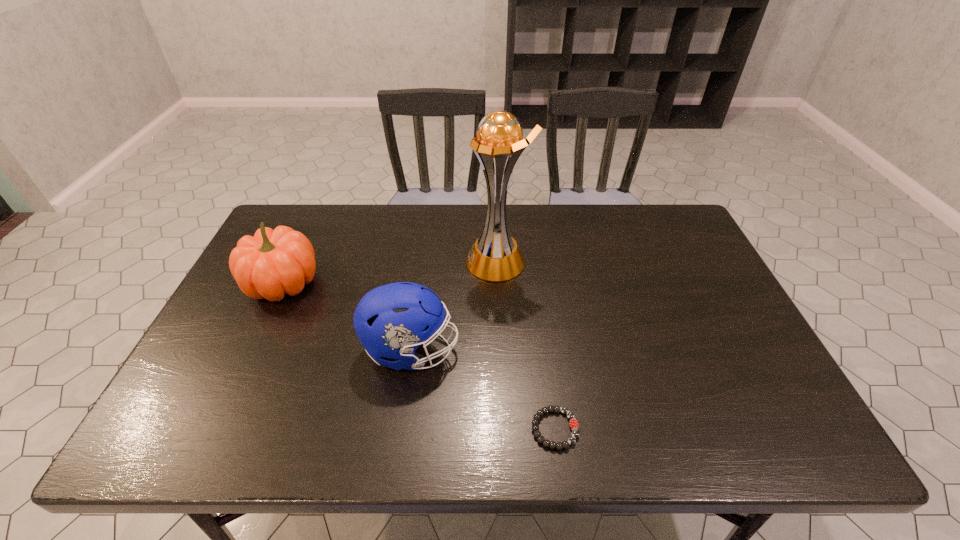
The height and width of the screenshot is (540, 960). What are the coordinates of `vacant point that satisfies the following two spatial constraints: 1. on the front-facing side of the tallest object; 2. on the right side of the shortest object` in the screenshot? It's located at (505, 429).